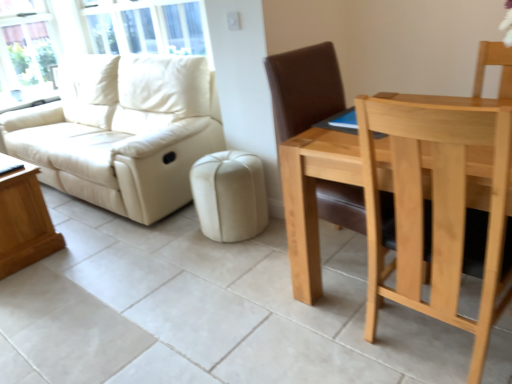
Question: Could you tell me if beige leather ottoman at center is facing transparent glass window at upper left?

Choices:
 (A) yes
 (B) no

Answer: (B)

Question: Does beige leather ottoman at center appear on the right side of transparent glass window at upper left?

Choices:
 (A) yes
 (B) no

Answer: (A)

Question: Is beige leather ottoman at center smaller than transparent glass window at upper left?

Choices:
 (A) no
 (B) yes

Answer: (B)

Question: Is transparent glass window at upper left completely or partially inside beige leather ottoman at center?

Choices:
 (A) no
 (B) yes

Answer: (A)

Question: Is beige leather ottoman at center thinner than transparent glass window at upper left?

Choices:
 (A) no
 (B) yes

Answer: (A)

Question: Considering the relative sizes of beige leather ottoman at center and transparent glass window at upper left in the image provided, is beige leather ottoman at center taller than transparent glass window at upper left?

Choices:
 (A) no
 (B) yes

Answer: (A)

Question: From a real-world perspective, is transparent glass window at upper left under light brown wood chair at right?

Choices:
 (A) yes
 (B) no

Answer: (B)

Question: From the image's perspective, does transparent glass window at upper left appear lower than light brown wood chair at right?

Choices:
 (A) yes
 (B) no

Answer: (B)

Question: Is transparent glass window at upper left located outside light brown wood chair at right?

Choices:
 (A) yes
 (B) no

Answer: (A)

Question: Is transparent glass window at upper left facing away from light brown wood chair at right?

Choices:
 (A) yes
 (B) no

Answer: (B)

Question: Is transparent glass window at upper left shorter than light brown wood chair at right?

Choices:
 (A) yes
 (B) no

Answer: (A)

Question: Considering the relative positions of transparent glass window at upper left and light brown wood chair at right in the image provided, is transparent glass window at upper left behind light brown wood chair at right?

Choices:
 (A) no
 (B) yes

Answer: (B)

Question: From a real-world perspective, is light brown wooden coffee table at lower left below matte cream leather couch at left?

Choices:
 (A) yes
 (B) no

Answer: (A)